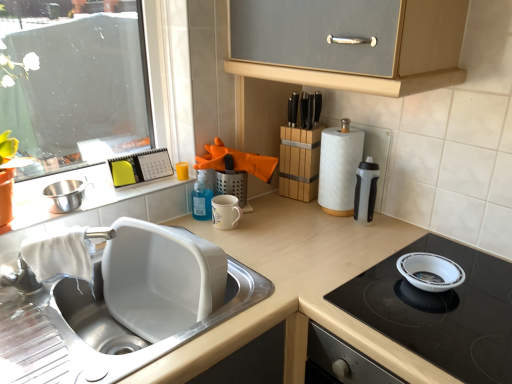
Describe the element at coordinates (339, 168) in the screenshot. I see `white textured paper towel at right` at that location.

This screenshot has width=512, height=384. What do you see at coordinates (441, 311) in the screenshot?
I see `white glossy bowl at upper right` at bounding box center [441, 311].

This screenshot has width=512, height=384. In order to click on white glossy window sill at upper left in this screenshot , I will do `click(100, 202)`.

Identify the location of paper towel that is above the white glossy bowl at upper right (from the image's perspective). This screenshot has height=384, width=512. (339, 168).

Is the position of white glossy bowl at upper right less distant than that of white textured paper towel at right?

Yes, it is.

Is white glossy bowl at upper right aimed at white textured paper towel at right?

No, white glossy bowl at upper right does not turn towards white textured paper towel at right.

What's the angular difference between matte white countertop at center and white glossy bowl at upper right's facing directions?

They differ by 3.62e-05 degrees in their facing directions.

Does matte white countertop at center have a lesser width compared to white glossy bowl at upper right?

In fact, matte white countertop at center might be wider than white glossy bowl at upper right.

Is matte white countertop at center placed right next to white glossy bowl at upper right?

No, matte white countertop at center is not touching white glossy bowl at upper right.

Is matte white countertop at center oriented towards white glossy bowl at upper right?

No, matte white countertop at center is not turned towards white glossy bowl at upper right.

How different are the orientations of white glossy window sill at upper left and stainless steel mixing bowl at sink left in degrees?

The angular difference between white glossy window sill at upper left and stainless steel mixing bowl at sink left is 2.05 degrees.

Is white glossy window sill at upper left facing away from stainless steel mixing bowl at sink left?

No, white glossy window sill at upper left is not facing the opposite direction of stainless steel mixing bowl at sink left.

From the image's perspective, is white glossy window sill at upper left located beneath stainless steel mixing bowl at sink left?

Correct, white glossy window sill at upper left appears lower than stainless steel mixing bowl at sink left in the image.

Is white glossy window sill at upper left to the left of stainless steel mixing bowl at sink left from the viewer's perspective?

In fact, white glossy window sill at upper left is to the right of stainless steel mixing bowl at sink left.

Between stainless steel mixing bowl at sink left and white glossy sink at lower left, which one appears on the left side from the viewer's perspective?

stainless steel mixing bowl at sink left.

Identify the location of mixing bowl on the left side of white glossy sink at lower left. (65, 195).

How far apart are stainless steel mixing bowl at sink left and white glossy sink at lower left?

A distance of 15.94 inches exists between stainless steel mixing bowl at sink left and white glossy sink at lower left.

From a real-world perspective, which object rests below the other?

white glossy sink at lower left, from a real-world perspective.

Is white glossy bowl at upper right thinner than white glossy window sill at upper left?

Incorrect, the width of white glossy bowl at upper right is not less than that of white glossy window sill at upper left.

Is point (469, 357) farther from viewer compared to point (151, 206)?

No.

Is white glossy bowl at upper right located outside white glossy window sill at upper left?

white glossy bowl at upper right is positioned outside white glossy window sill at upper left.

Is white textured paper towel at right facing towards translucent plastic water bottle at right?

No, white textured paper towel at right is not oriented towards translucent plastic water bottle at right.

From a real-world perspective, is white textured paper towel at right above or below translucent plastic water bottle at right?

white textured paper towel at right is above translucent plastic water bottle at right.

Considering the sizes of objects white textured paper towel at right and translucent plastic water bottle at right in the image provided, who is bigger, white textured paper towel at right or translucent plastic water bottle at right?

white textured paper towel at right is bigger.

Is matte white countertop at center wider than translucent plastic water bottle at right?

Indeed, matte white countertop at center has a greater width compared to translucent plastic water bottle at right.

Consider the image. From a real-world perspective, between matte white countertop at center and translucent plastic water bottle at right, who is vertically lower?

matte white countertop at center, from a real-world perspective.

Is point (261, 245) closer or farther from the camera than point (365, 217)?

Point (261, 245).

What are the coordinates of `paper towel behind the white glossy bowl at upper right` in the screenshot? It's located at (339, 168).

At what (x,y) coordinates should I click in order to perform the action: click on gas stove located on the right of matte white countertop at center. Please return your answer as a coordinate pair (x, y). The image size is (512, 384). Looking at the image, I should click on (441, 311).

From the image, which object appears to be nearer to white glossy sink at lower left, translucent plastic water bottle at right or white textured paper towel at right?

white textured paper towel at right lies closer to white glossy sink at lower left than the other object.

Looking at the image, which one is located closer to matte white countertop at center, white glossy sink at lower left or white glossy window sill at upper left?

white glossy sink at lower left.

Considering their positions, is translucent plastic water bottle at right positioned further to matte white countertop at center than white glossy bowl at upper right?

translucent plastic water bottle at right lies further to matte white countertop at center than the other object.

From the image, which object appears to be farther from stainless steel mixing bowl at sink left, white glossy bowl at upper right or matte white countertop at center?

white glossy bowl at upper right is further to stainless steel mixing bowl at sink left.

Considering their positions, is translucent plastic water bottle at right positioned further to white glossy bowl at upper right than white glossy window sill at upper left?

Among the two, white glossy window sill at upper left is located further to white glossy bowl at upper right.

Based on their spatial positions, is stainless steel mixing bowl at sink left or white glossy sink at lower left further from white glossy bowl at upper right?

Among the two, stainless steel mixing bowl at sink left is located further to white glossy bowl at upper right.

Based on their spatial positions, is white glossy window sill at upper left or matte white countertop at center further from translucent plastic water bottle at right?

white glossy window sill at upper left.

Based on their spatial positions, is translucent plastic water bottle at right or white glossy sink at lower left closer to white glossy window sill at upper left?

The object closer to white glossy window sill at upper left is white glossy sink at lower left.

Locate an element on the screen. This screenshot has width=512, height=384. kitchen appliance situated between white glossy sink at lower left and white glossy bowl at upper right from left to right is located at coordinates pos(365,191).

Where is `countertop between white glossy window sill at upper left and white glossy bowl at upper right in the horizontal direction`? The width and height of the screenshot is (512, 384). countertop between white glossy window sill at upper left and white glossy bowl at upper right in the horizontal direction is located at coordinates (298, 288).

Where is `kitchen appliance between white glossy window sill at upper left and white glossy bowl at upper right in the horizontal direction`? This screenshot has width=512, height=384. kitchen appliance between white glossy window sill at upper left and white glossy bowl at upper right in the horizontal direction is located at coordinates (365, 191).

I want to click on sink between stainless steel mixing bowl at sink left and white glossy bowl at upper right from left to right, so click(120, 310).